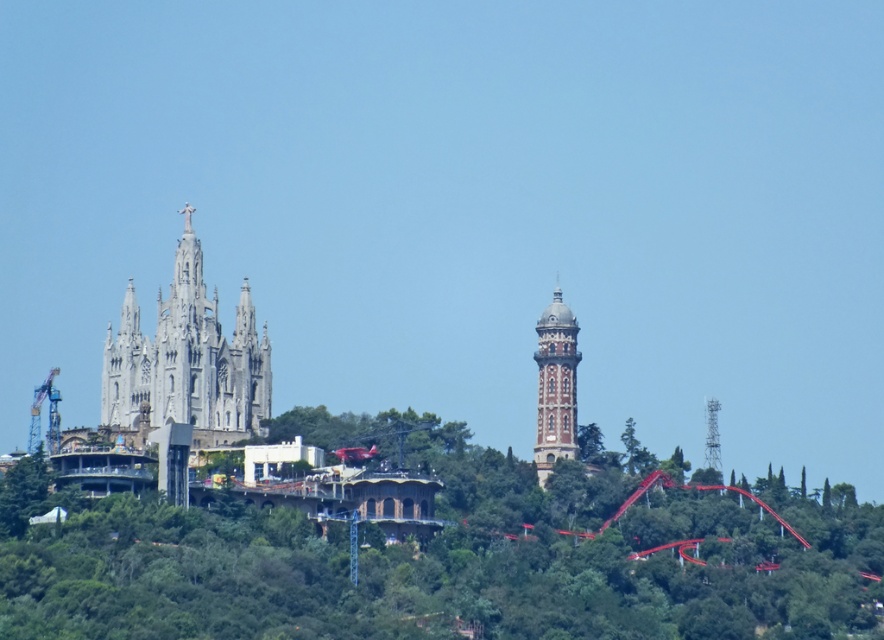
Is point (537, 400) closer to camera compared to point (636, 458)?

That is True.

Which is behind, point (568, 387) or point (629, 428)?

Positioned behind is point (629, 428).

I want to click on brown brick tower at center right, so click(x=555, y=385).

Which is in front, point (348, 500) or point (629, 454)?

Positioned in front is point (348, 500).

Between point (453, 492) and point (625, 449), which one is positioned behind?

Positioned behind is point (625, 449).

The height and width of the screenshot is (640, 884). Identify the location of wooden roller coaster at center. (399, 529).

Consider the image. Which is below, wooden roller coaster at center or brown brick tower at center right?

Positioned lower is wooden roller coaster at center.

This screenshot has width=884, height=640. Describe the element at coordinates (399, 529) in the screenshot. I see `wooden roller coaster at center` at that location.

Image resolution: width=884 pixels, height=640 pixels. I want to click on wooden roller coaster at center, so click(399, 529).